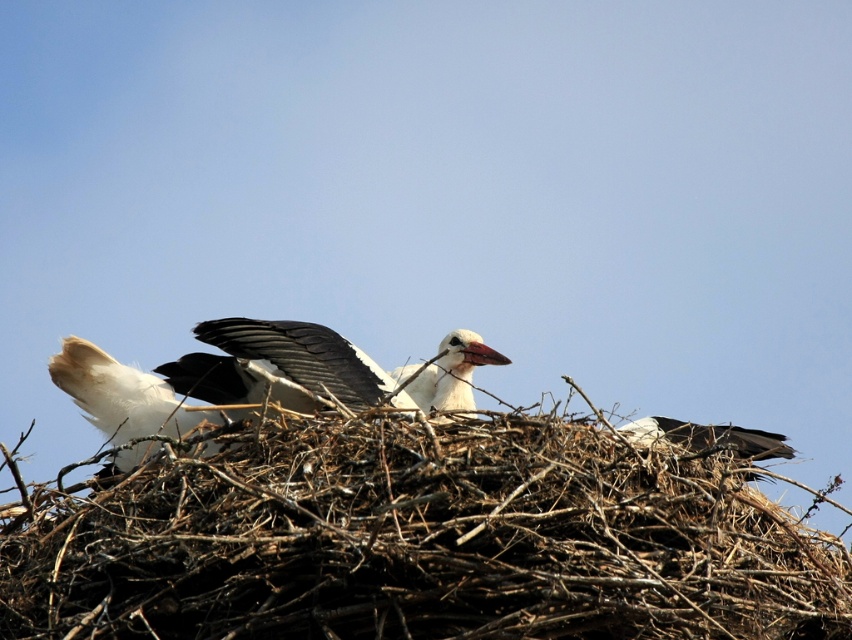
Can you confirm if brown twigs nest at center is thinner than white matte bird at center?

No, brown twigs nest at center is not thinner than white matte bird at center.

Does point (190, 524) come behind point (246, 404)?

No.

This screenshot has height=640, width=852. What are the coordinates of `brown twigs nest at center` in the screenshot? It's located at coord(419,540).